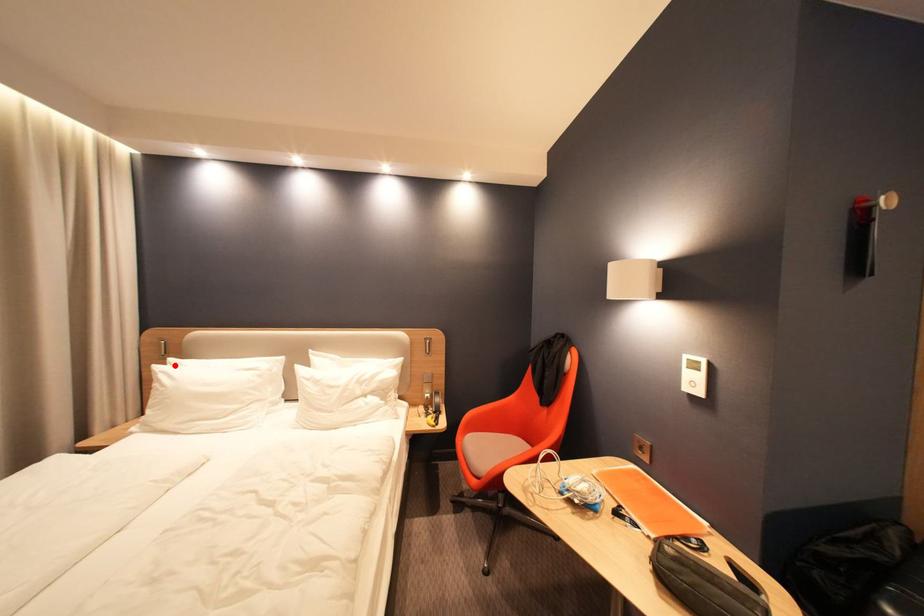
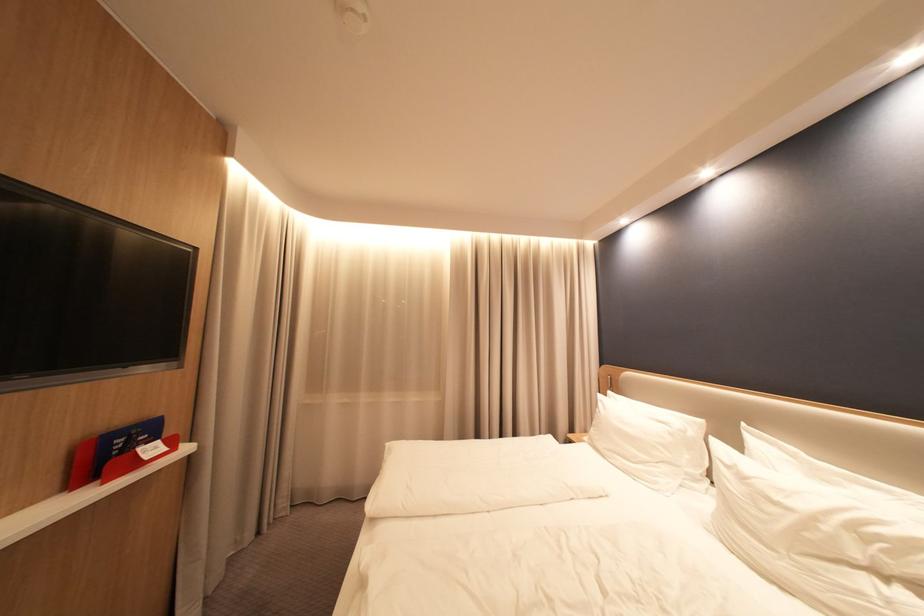
Question: I am providing you with two images of the same scene from different viewpoints. A red point is marked on the first image. At the location where the point appears in image 1, is it still visible in image 2?

Choices:
 (A) Yes
 (B) No

Answer: (A)